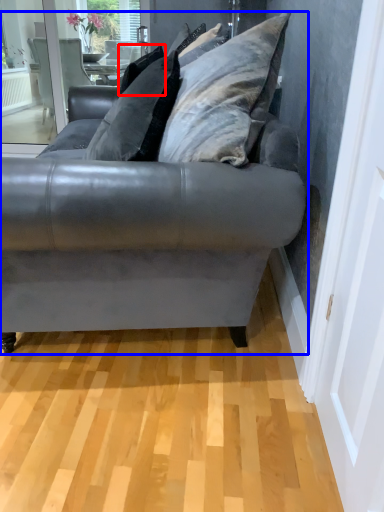
Question: Which point is closer to the camera, pillow (highlighted by a red box) or studio couch (highlighted by a blue box)?

Choices:
 (A) pillow
 (B) studio couch

Answer: (B)